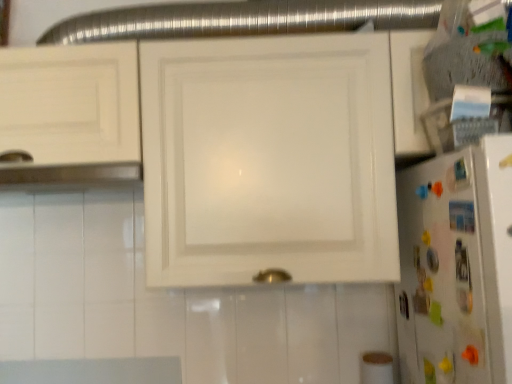
Question: Is white glossy refrigerator at right shorter than white glossy cabinet at center?

Choices:
 (A) no
 (B) yes

Answer: (B)

Question: From a real-world perspective, is white glossy refrigerator at right physically below white glossy cabinet at center?

Choices:
 (A) yes
 (B) no

Answer: (A)

Question: Does white glossy refrigerator at right have a larger size compared to white glossy cabinet at center?

Choices:
 (A) yes
 (B) no

Answer: (B)

Question: Is white glossy refrigerator at right in contact with white glossy cabinet at center?

Choices:
 (A) no
 (B) yes

Answer: (A)

Question: Is white glossy refrigerator at right wider than white glossy cabinet at center?

Choices:
 (A) yes
 (B) no

Answer: (B)

Question: Would you say white glossy refrigerator at right is a long distance from white glossy cabinet at center?

Choices:
 (A) yes
 (B) no

Answer: (B)

Question: Is white glossy cabinet at center far from white glossy refrigerator at right?

Choices:
 (A) yes
 (B) no

Answer: (B)

Question: Is white glossy cabinet at center oriented away from white glossy refrigerator at right?

Choices:
 (A) no
 (B) yes

Answer: (A)

Question: From the image's perspective, does white glossy cabinet at center appear higher than white glossy refrigerator at right?

Choices:
 (A) no
 (B) yes

Answer: (B)

Question: Does white glossy cabinet at center lie in front of white glossy refrigerator at right?

Choices:
 (A) no
 (B) yes

Answer: (A)

Question: From a real-world perspective, is white glossy cabinet at center physically below white glossy refrigerator at right?

Choices:
 (A) yes
 (B) no

Answer: (B)

Question: From a real-world perspective, is white glossy cabinet at center on top of white glossy refrigerator at right?

Choices:
 (A) no
 (B) yes

Answer: (B)

Question: Looking at their shapes, would you say white glossy cabinet at center is wider or thinner than white glossy refrigerator at right?

Choices:
 (A) wide
 (B) thin

Answer: (A)